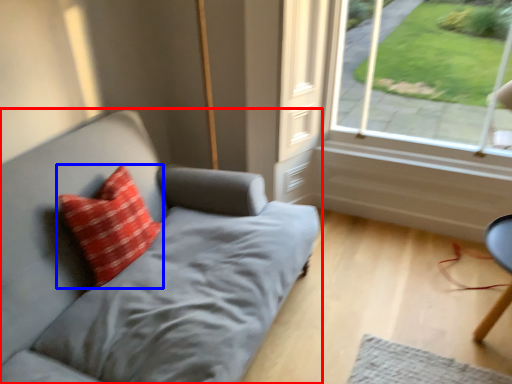
Question: Which point is further to the camera, studio couch (highlighted by a red box) or pillow (highlighted by a blue box)?

Choices:
 (A) studio couch
 (B) pillow

Answer: (B)